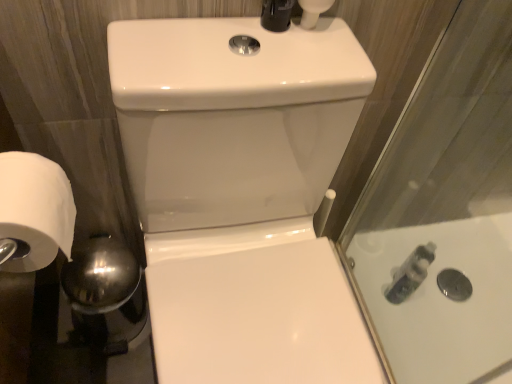
Find the location of a particular element. free location to the right of translucent plastic bottle at right is located at coordinates (443, 308).